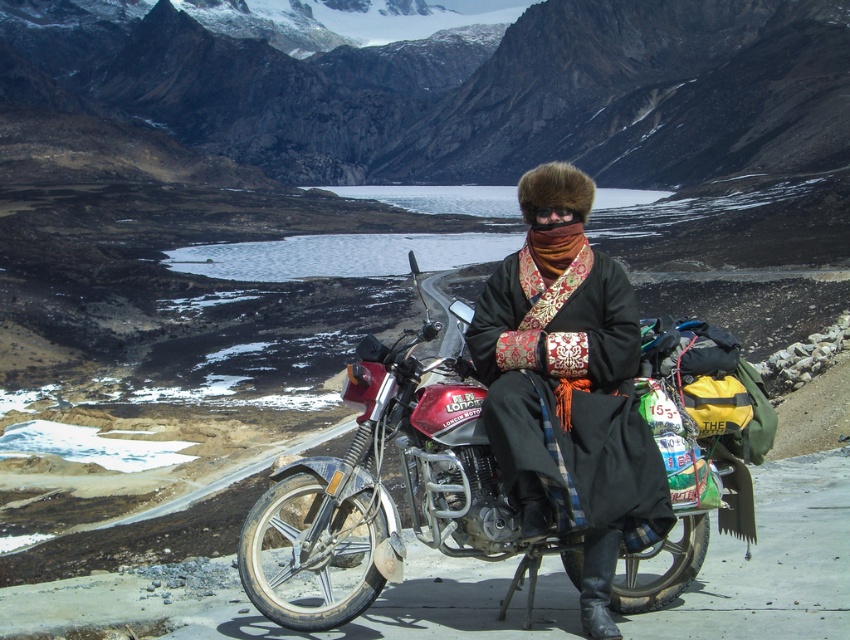
You are planning to take a photo of the metallic red motorcycle at center and the black fur hat at center. Which object should you focus on first if you want to ensure both are in sharp focus, considering their sizes?

Since the metallic red motorcycle at center is larger than the black fur hat at center, you should focus on the metallic red motorcycle at center first to ensure both are in sharp focus.

You are a photographer planning to take a portrait of the person wearing the black fur hat at center while ensuring the metallic red motorcycle at center is visible in the background. Based on their positions, will you need to adjust your camera angle upwards or downwards to achieve this composition?

The metallic red motorcycle at center is below the black fur hat at center, so to capture both the person wearing the hat and the motorcycle in the background, you would need to angle your camera downwards.